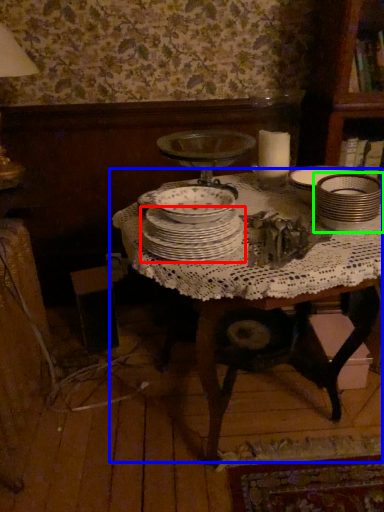
Question: Based on their relative distances, which object is nearer to plate (highlighted by a red box)? Choose from table (highlighted by a blue box) and tableware (highlighted by a green box).

Choices:
 (A) table
 (B) tableware

Answer: (A)